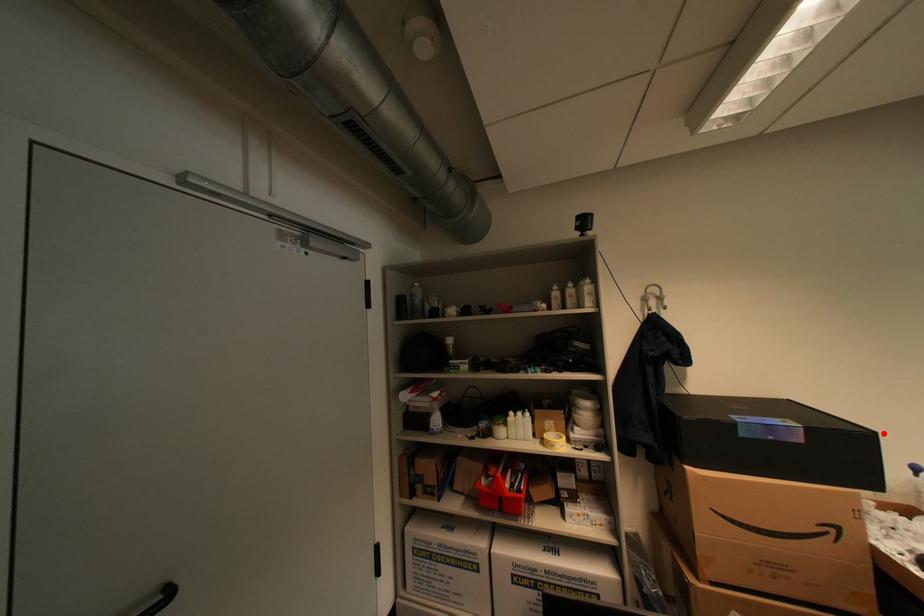
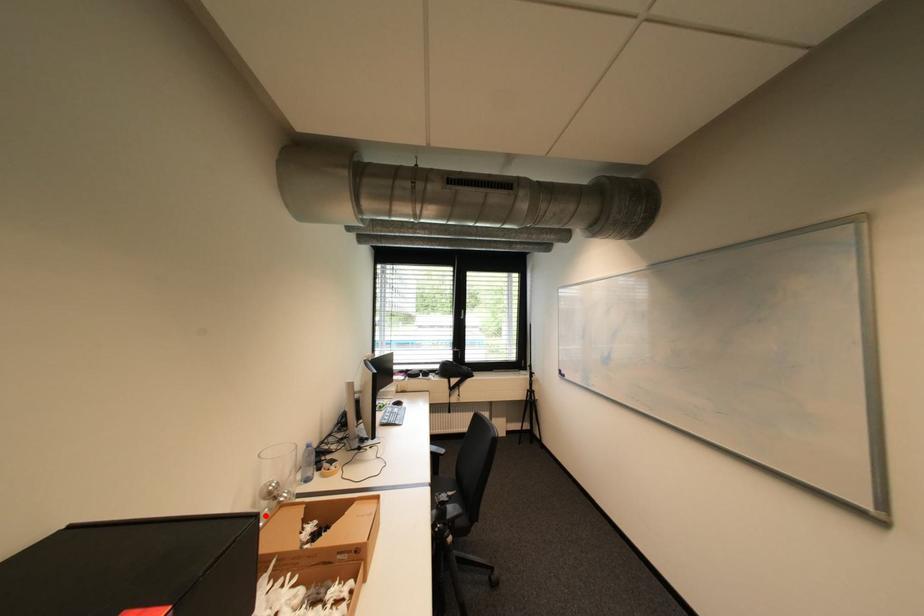
I am providing you with two images of the same scene from different viewpoints. A red point is marked on the first image and another point is marked on the second image. Are the points marked in image1 and image2 representing the same 3D position?

Yes